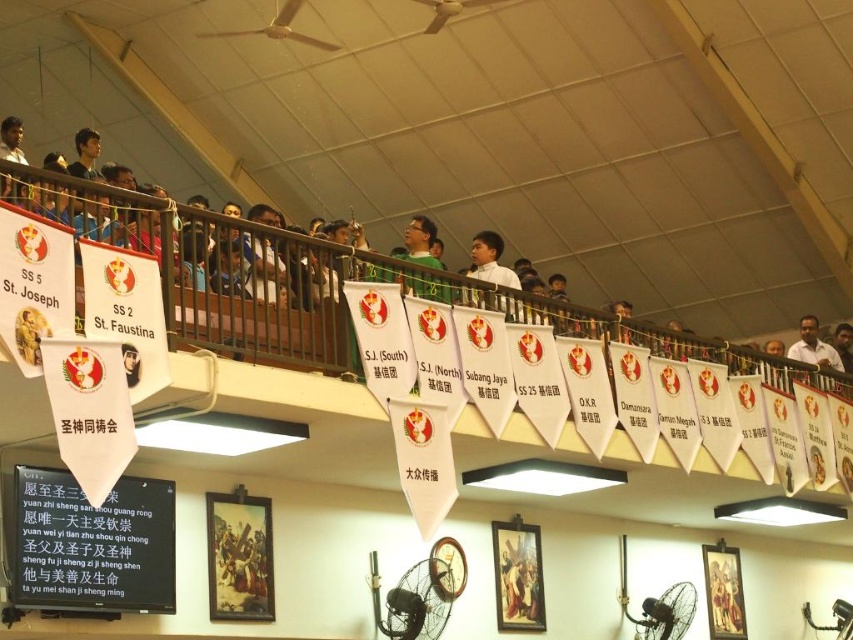
Between white paper banner at upper center and dark skin man at upper right, which one is positioned higher?

white paper banner at upper center is above.

Does point (329, 321) come closer to viewer compared to point (817, 358)?

That is True.

Identify the location of white paper banner at upper center. This screenshot has height=640, width=853. (305, 282).

Can you confirm if white paper banner at upper center is shorter than white matte shirt at upper center?

In fact, white paper banner at upper center may be taller than white matte shirt at upper center.

Is point (22, 180) more distant than point (480, 298)?

That is False.

At what (x,y) coordinates should I click in order to perform the action: click on white paper banner at upper center. Please return your answer as a coordinate pair (x, y). The image size is (853, 640). Looking at the image, I should click on tap(305, 282).

Can you confirm if white matte shirt at upper center is wider than dark skin man at upper right?

Incorrect, white matte shirt at upper center's width does not surpass dark skin man at upper right's.

At what (x,y) coordinates should I click in order to perform the action: click on white matte shirt at upper center. Please return your answer as a coordinate pair (x, y). Image resolution: width=853 pixels, height=640 pixels. Looking at the image, I should click on (490, 260).

Does point (469, 275) come closer to viewer compared to point (840, 364)?

That is True.

At what (x,y) coordinates should I click in order to perform the action: click on white matte shirt at upper center. Please return your answer as a coordinate pair (x, y). The image size is (853, 640). Looking at the image, I should click on (490, 260).